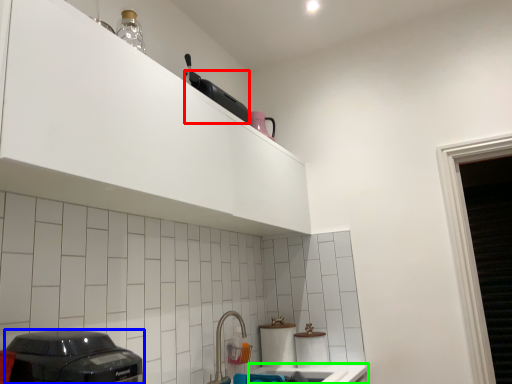
Question: Estimate the real-world distances between objects in this image. Which object is closer to appliance (highlighted by a red box), home appliance (highlighted by a blue box) or counter top (highlighted by a green box)?

Choices:
 (A) home appliance
 (B) counter top

Answer: (A)